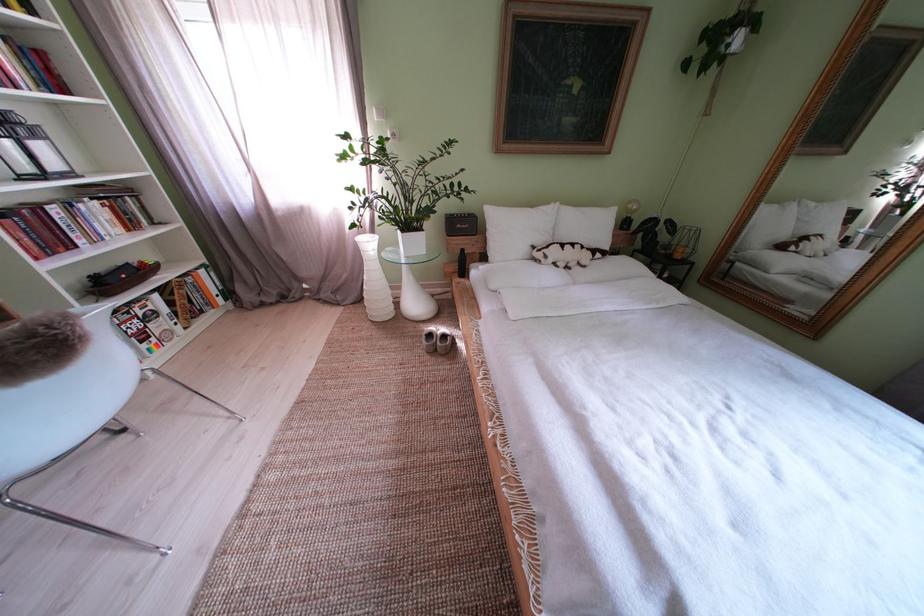
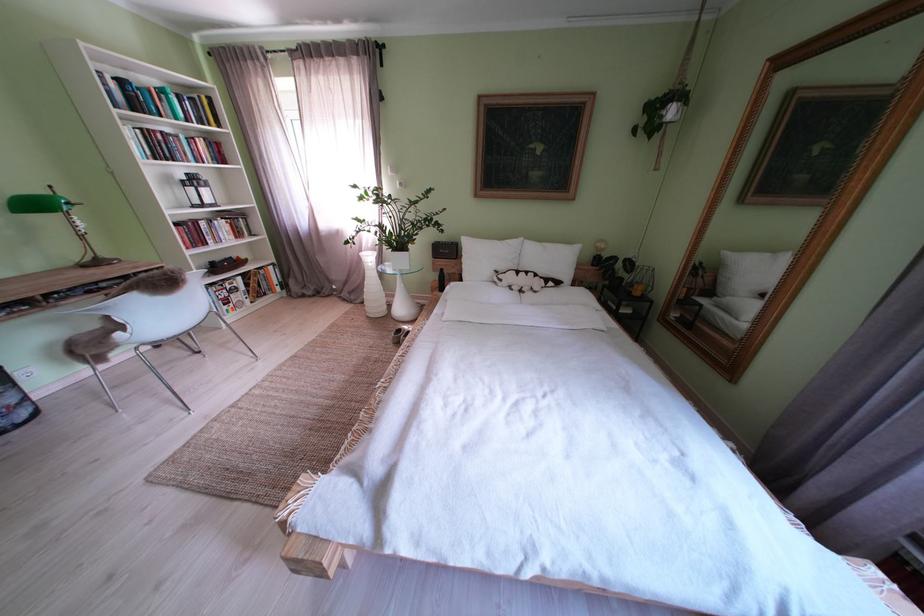
Locate, in the second image, the point that corresponds to point (415, 237) in the first image.

(405, 256)